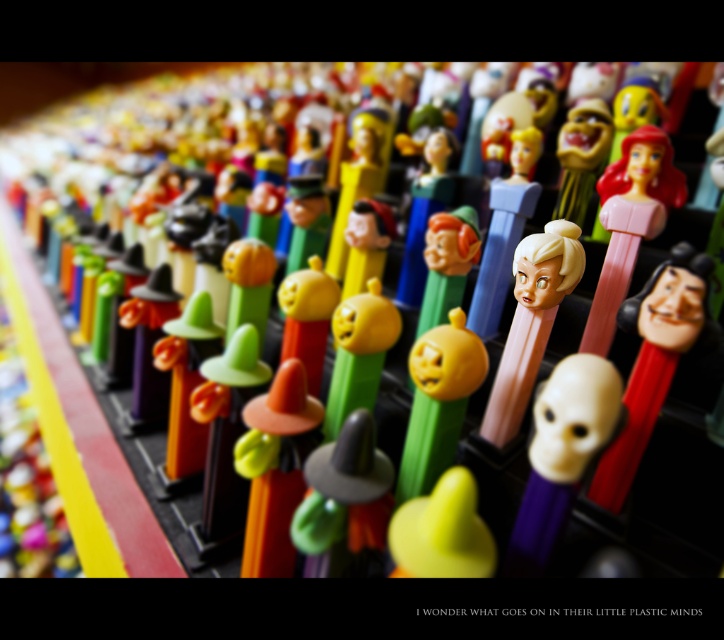
Between white matte skull at center and orange matte pumpkin at center, which one is positioned lower?

Positioned lower is white matte skull at center.

Does white matte skull at center appear under orange matte pumpkin at center?

Correct, white matte skull at center is located below orange matte pumpkin at center.

You are a GUI agent. You are given a task and a screenshot of the screen. Output one action in this format:
    pyautogui.click(x=<x>, y=<y>)
    Task: Click on the white matte skull at center
    Image resolution: width=724 pixels, height=640 pixels.
    Given the screenshot: What is the action you would take?
    pyautogui.click(x=560, y=452)

Identify the location of white matte skull at center. (560, 452).

Is orange matte pumpkin at center positioned before matte yellow plastic pumpkin at center?

Yes, orange matte pumpkin at center is closer to the viewer.

Which is more to the right, orange matte pumpkin at center or matte yellow plastic pumpkin at center?

orange matte pumpkin at center

Is point (447, 356) farther from viewer compared to point (387, 332)?

No, it is in front of (387, 332).

The height and width of the screenshot is (640, 724). I want to click on orange matte pumpkin at center, so [x=437, y=401].

This screenshot has width=724, height=640. What do you see at coordinates (560, 452) in the screenshot?
I see `white matte skull at center` at bounding box center [560, 452].

Does point (539, 515) come behind point (513, 385)?

No, (539, 515) is in front of (513, 385).

What are the coordinates of `white matte skull at center` in the screenshot? It's located at (560, 452).